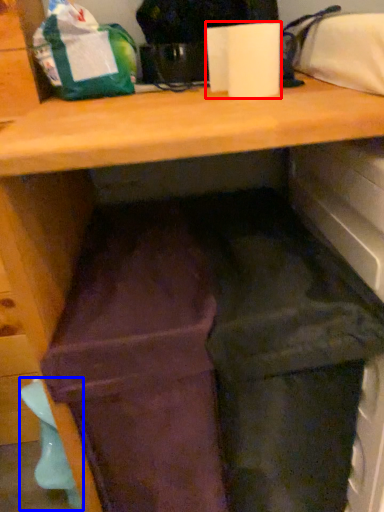
Question: Which point is closer to the camera, paper towel (highlighted by a red box) or waste (highlighted by a blue box)?

Choices:
 (A) paper towel
 (B) waste

Answer: (A)